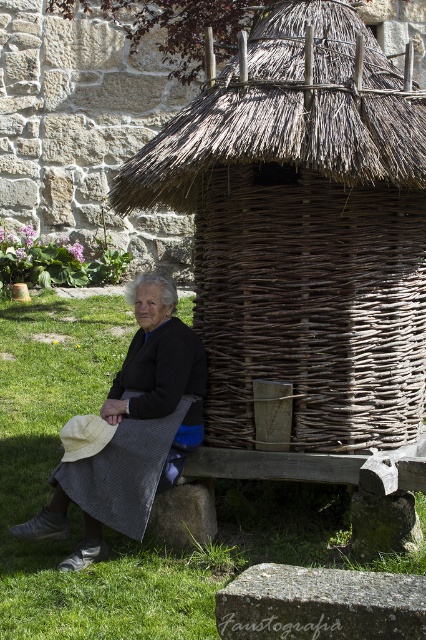
You are planning to place a small stool between the brown woven hut at center and the woven brown basket at center. Based on their widths, which object should you position closer to the stool to ensure it fits comfortably?

The stool should be positioned closer to the woven brown basket at center since the brown woven hut at center is wider, leaving more space between them for the stool.

You are a delivery person who needs to place a small package between the brown woven hut at center and the woven brown basket at center. The package requires at least 10 inches of space to fit. Can you fit the package between them?

The distance between the brown woven hut at center and the woven brown basket at center is 9.86 inches, which is less than the required 10 inches. Therefore, the package cannot be placed between them.

You are an architect designing a new outdoor seating area and want to place both the brown woven hut at center and the woven brown basket at center. Based on their sizes, which object should be placed closer to the entrance to ensure visitors can easily see the taller structure?

The brown woven hut at center is much taller than the woven brown basket at center, so placing the brown woven hut at center closer to the entrance will ensure visitors can easily see the taller structure.